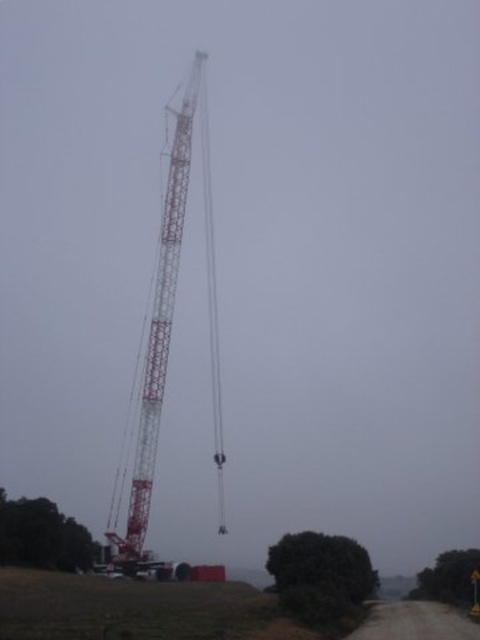
You are standing at the point marked as point [167,340] in the image. What object is located exactly at that point?

The white metallic crane at center is located exactly at point [167,340].